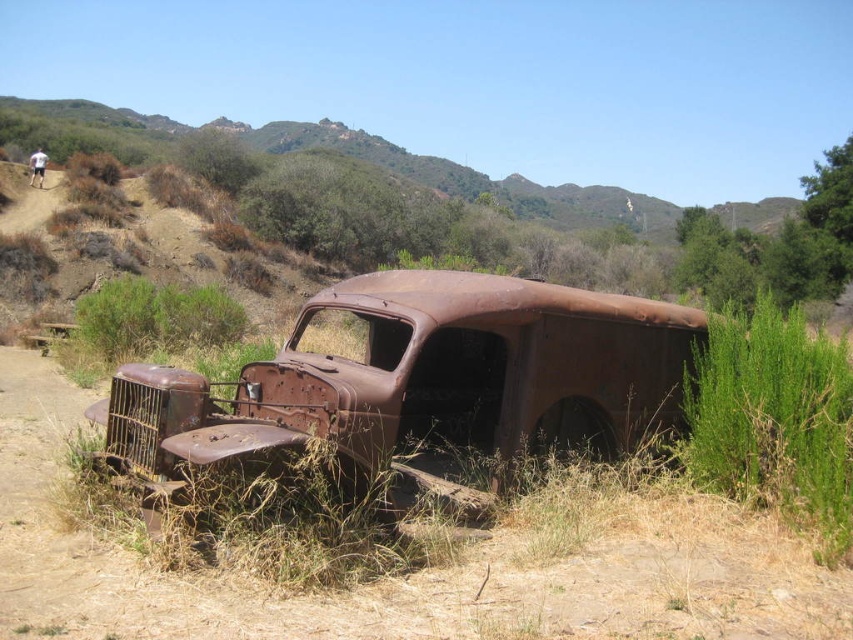
Who is positioned more to the left, rusty metal truck at center or brown rusted car at lower left?

brown rusted car at lower left is more to the left.

Locate an element on the screen. The width and height of the screenshot is (853, 640). rusty metal truck at center is located at coordinates (421, 376).

This screenshot has width=853, height=640. Identify the location of rusty metal truck at center. (421, 376).